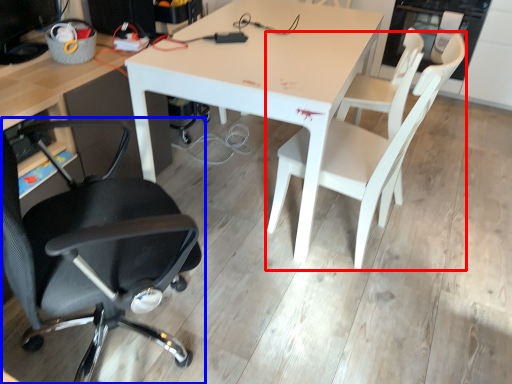
Question: Which object is closer to the camera taking this photo, chair (highlighted by a red box) or chair (highlighted by a blue box)?

Choices:
 (A) chair
 (B) chair

Answer: (B)